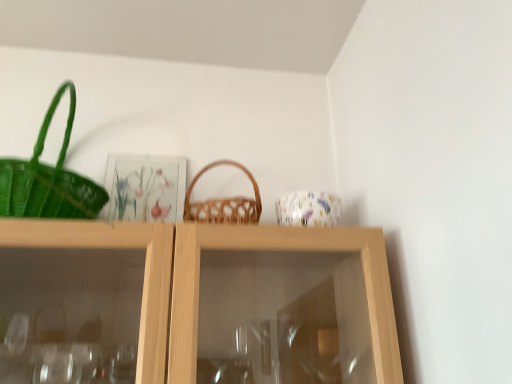
Question: Is floral-patterned ceramic cup at upper center not near woven brown picnic basket at center?

Choices:
 (A) yes
 (B) no

Answer: (B)

Question: Is floral-patterned ceramic cup at upper center aimed at woven brown picnic basket at center?

Choices:
 (A) no
 (B) yes

Answer: (A)

Question: Can you see floral-patterned ceramic cup at upper center touching woven brown picnic basket at center?

Choices:
 (A) yes
 (B) no

Answer: (B)

Question: Can you confirm if floral-patterned ceramic cup at upper center is taller than woven brown picnic basket at center?

Choices:
 (A) no
 (B) yes

Answer: (A)

Question: Is floral-patterned ceramic cup at upper center behind woven brown picnic basket at center?

Choices:
 (A) no
 (B) yes

Answer: (B)

Question: From a real-world perspective, is floral-patterned ceramic cup at upper center on woven brown picnic basket at center?

Choices:
 (A) yes
 (B) no

Answer: (B)

Question: Is woven brown picnic basket at center facing away from floral-patterned ceramic cup at upper center?

Choices:
 (A) no
 (B) yes

Answer: (A)

Question: Does woven brown picnic basket at center have a greater width compared to floral-patterned ceramic cup at upper center?

Choices:
 (A) yes
 (B) no

Answer: (A)

Question: Is woven brown picnic basket at center shorter than floral-patterned ceramic cup at upper center?

Choices:
 (A) no
 (B) yes

Answer: (A)

Question: From the image's perspective, is woven brown picnic basket at center beneath floral-patterned ceramic cup at upper center?

Choices:
 (A) yes
 (B) no

Answer: (B)

Question: Does woven brown picnic basket at center have a larger size compared to floral-patterned ceramic cup at upper center?

Choices:
 (A) no
 (B) yes

Answer: (B)

Question: Is woven brown picnic basket at center positioned before floral-patterned ceramic cup at upper center?

Choices:
 (A) no
 (B) yes

Answer: (B)

Question: In the image, is floral-patterned ceramic cup at upper center on the left side or the right side of woven brown picnic basket at center?

Choices:
 (A) right
 (B) left

Answer: (A)